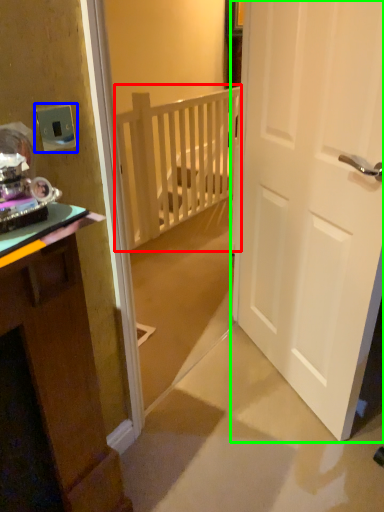
Question: Which is farther away from balustrade (highlighted by a red box)? electric outlet (highlighted by a blue box) or door (highlighted by a green box)?

Choices:
 (A) electric outlet
 (B) door

Answer: (A)